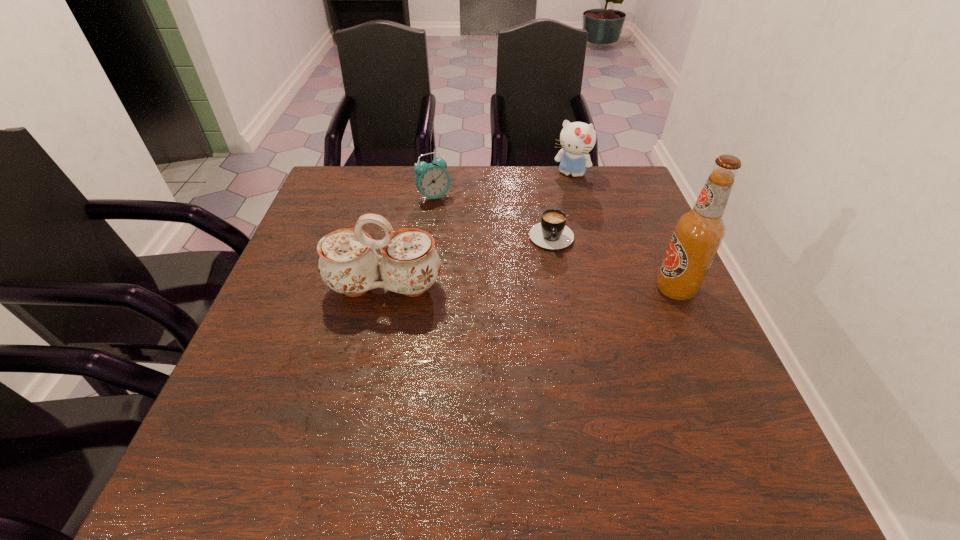
Where is `free space between the alarm clock and the third tallest object`? The width and height of the screenshot is (960, 540). free space between the alarm clock and the third tallest object is located at coordinates (502, 186).

Image resolution: width=960 pixels, height=540 pixels. I want to click on vacant space that is in between the shortest object and the tallest object, so click(x=613, y=261).

The height and width of the screenshot is (540, 960). In order to click on vacant area that lies between the rightmost object and the farthest object in this screenshot , I will do `click(623, 232)`.

The width and height of the screenshot is (960, 540). Find the location of `free space that is in between the chinaware and the kitten`. free space that is in between the chinaware and the kitten is located at coordinates (477, 231).

Find the location of a particular element. This screenshot has width=960, height=540. unoccupied area between the kitten and the shortest object is located at coordinates [561, 203].

At what (x,y) coordinates should I click in order to perform the action: click on blank region between the shortest object and the beer bottle. Please return your answer as a coordinate pair (x, y). Looking at the image, I should click on (613, 261).

Identify the location of empty space that is in between the shortest object and the farthest object. This screenshot has height=540, width=960. (561, 203).

This screenshot has width=960, height=540. Find the location of `vacant area that lies between the farthest object and the rightmost object`. vacant area that lies between the farthest object and the rightmost object is located at coordinates (623, 232).

You are a GUI agent. You are given a task and a screenshot of the screen. Output one action in this format:
    pyautogui.click(x=<x>, y=<y>)
    Task: Click on the free space between the chinaware and the shortest object
    This screenshot has width=960, height=540.
    Given the screenshot: What is the action you would take?
    pyautogui.click(x=468, y=260)

This screenshot has width=960, height=540. Find the location of `vacant point located between the third farthest object and the chinaware`. vacant point located between the third farthest object and the chinaware is located at coordinates (468, 260).